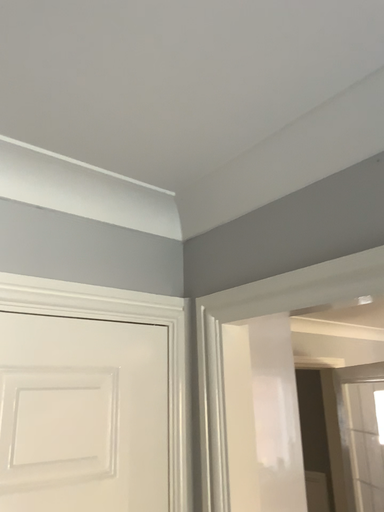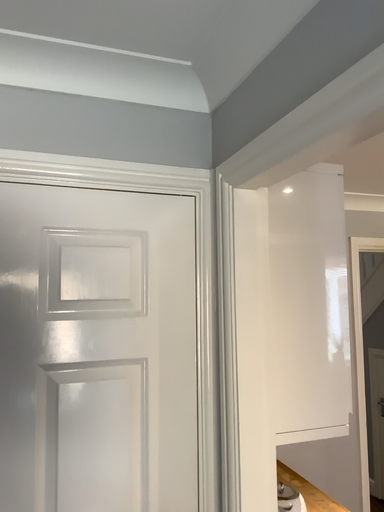
Question: How did the camera likely rotate when shooting the video?

Choices:
 (A) rotated right
 (B) rotated left

Answer: (B)